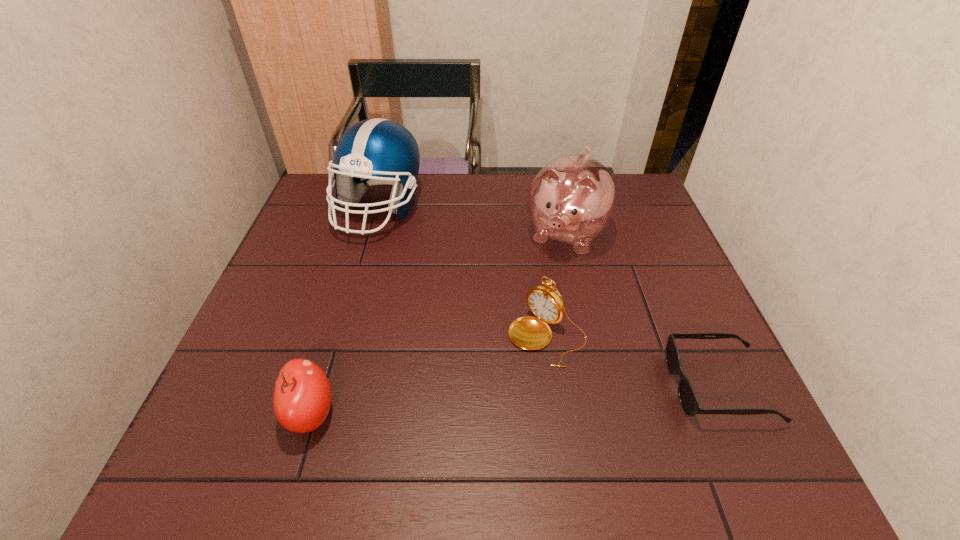
Find the location of a particular element. The height and width of the screenshot is (540, 960). vacant area between the apple and the sunglasses is located at coordinates (515, 400).

Where is `vacant region between the piggy bank and the pocket watch`? The width and height of the screenshot is (960, 540). vacant region between the piggy bank and the pocket watch is located at coordinates (557, 286).

I want to click on free point between the pocket watch and the shortest object, so click(x=633, y=361).

In order to click on vacant space in between the pocket watch and the piggy bank in this screenshot , I will do `click(557, 286)`.

Locate an element on the screen. This screenshot has height=540, width=960. free space between the shortest object and the piggy bank is located at coordinates (642, 310).

The width and height of the screenshot is (960, 540). Find the location of `vacant area that lies between the sunglasses and the apple`. vacant area that lies between the sunglasses and the apple is located at coordinates (515, 400).

Find the location of a particular element. The width and height of the screenshot is (960, 540). free space between the rightmost object and the apple is located at coordinates (515, 400).

At what (x,y) coordinates should I click in order to perform the action: click on unoccupied area between the piggy bank and the football helmet. Please return your answer as a coordinate pair (x, y). Looking at the image, I should click on (472, 221).

Identify which object is located as the nearest to the piggy bank. Please provide its 2D coordinates. Your answer should be formatted as a tuple, i.e. [(x, y)], where the tuple contains the x and y coordinates of a point satisfying the conditions above.

[(531, 333)]

Locate an element on the screen. Image resolution: width=960 pixels, height=540 pixels. object that stands as the second closest to the pocket watch is located at coordinates (688, 399).